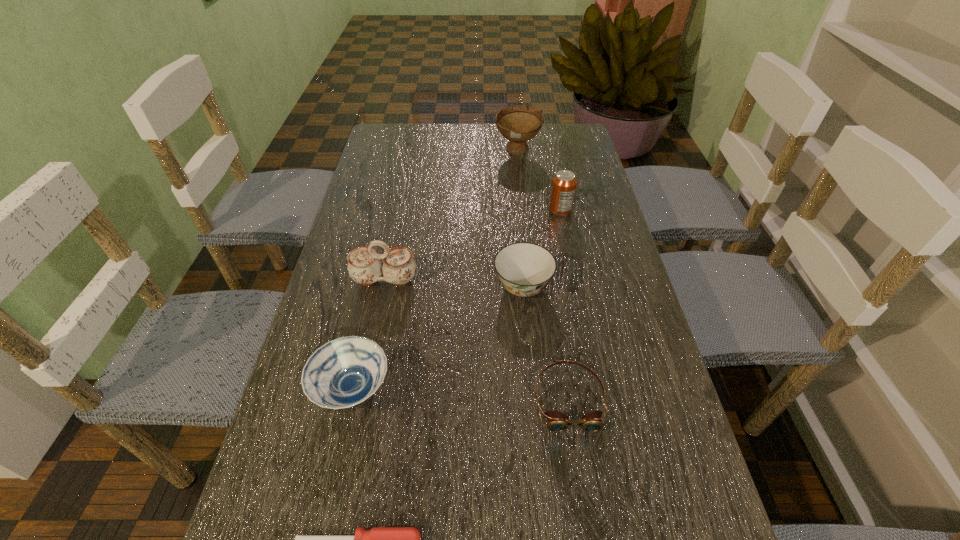
I want to click on the farthest object, so click(519, 123).

Locate an element on the screen. This screenshot has width=960, height=540. the farthest soup bowl is located at coordinates (519, 123).

Locate an element on the screen. The image size is (960, 540). chinaware is located at coordinates (398, 267).

Where is `the second farthest object`? The image size is (960, 540). the second farthest object is located at coordinates (563, 187).

This screenshot has height=540, width=960. I want to click on the second farthest soup bowl, so (524, 269).

Image resolution: width=960 pixels, height=540 pixels. Find the location of `the nearest soup bowl`. the nearest soup bowl is located at coordinates (344, 372).

This screenshot has width=960, height=540. In order to click on the second shortest object in this screenshot , I will do `click(556, 421)`.

The height and width of the screenshot is (540, 960). In order to click on vacant space located 0.310m on the left of the farthest soup bowl in this screenshot , I will do `click(404, 152)`.

Locate an element on the screen. The image size is (960, 540). vacant space located 0.340m by the handle of the chinaware is located at coordinates point(354,426).

The image size is (960, 540). I want to click on free spot located on the back of the can, so click(545, 136).